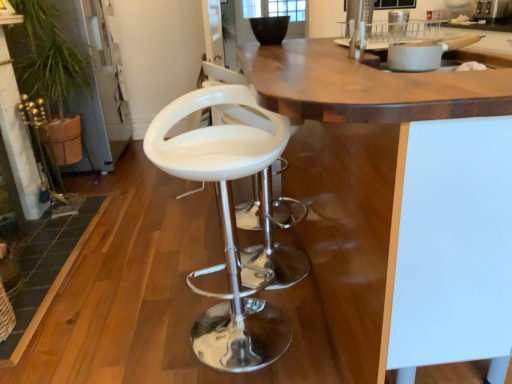
Find the location of a particular element. This screenshot has width=512, height=384. vacant space behind white glossy bar stool at center is located at coordinates (224, 268).